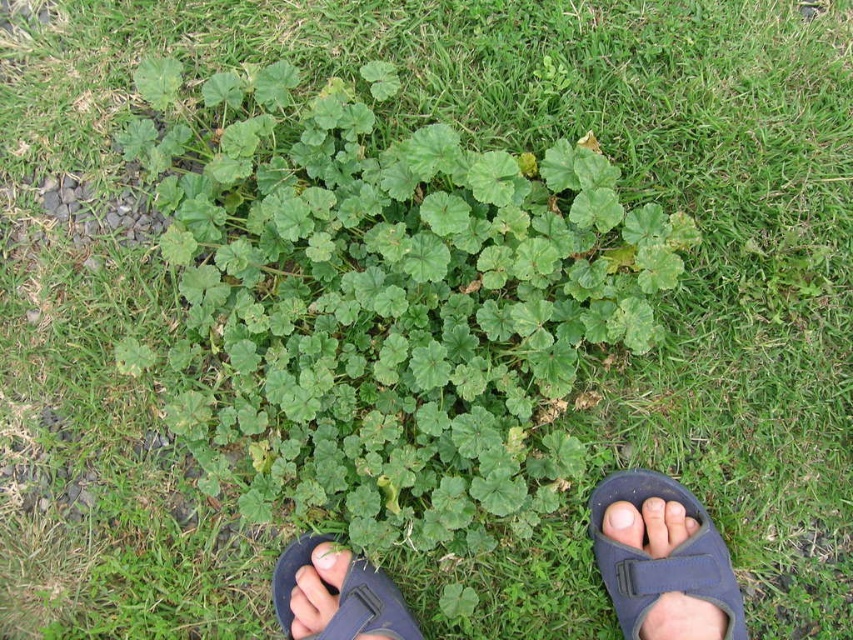
Which of these two, dark blue fabric sandal at lower right or black fabric sandal at lower center, stands taller?

dark blue fabric sandal at lower right is taller.

Can you confirm if dark blue fabric sandal at lower right is taller than black fabric sandal at lower center?

Yes, dark blue fabric sandal at lower right is taller than black fabric sandal at lower center.

I want to click on dark blue fabric sandal at lower right, so click(660, 556).

Locate an element on the screen. The image size is (853, 640). dark blue fabric sandal at lower right is located at coordinates (660, 556).

Which is more to the left, pink flesh at center or green leafy plant at center?

green leafy plant at center

Based on the photo, can you confirm if pink flesh at center is wider than green leafy plant at center?

No.

Between point (614, 531) and point (346, 570), which one is positioned in front?

Point (346, 570) is in front.

Locate an element on the screen. This screenshot has height=640, width=853. pink flesh at center is located at coordinates tap(624, 524).

This screenshot has height=640, width=853. I want to click on dark blue fabric sandal at lower right, so click(x=660, y=556).

Does dark blue fabric sandal at lower right appear over green leafy plant at center?

Correct, dark blue fabric sandal at lower right is located above green leafy plant at center.

The image size is (853, 640). What are the coordinates of `dark blue fabric sandal at lower right` in the screenshot? It's located at (660, 556).